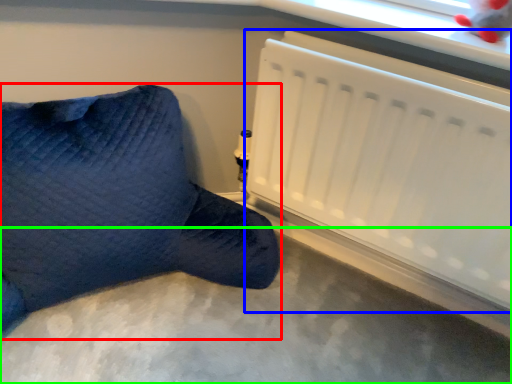
Question: Based on their relative distances, which object is farther from furniture (highlighted by a red box)? Choose from radiator (highlighted by a blue box) and concrete (highlighted by a green box).

Choices:
 (A) radiator
 (B) concrete

Answer: (A)